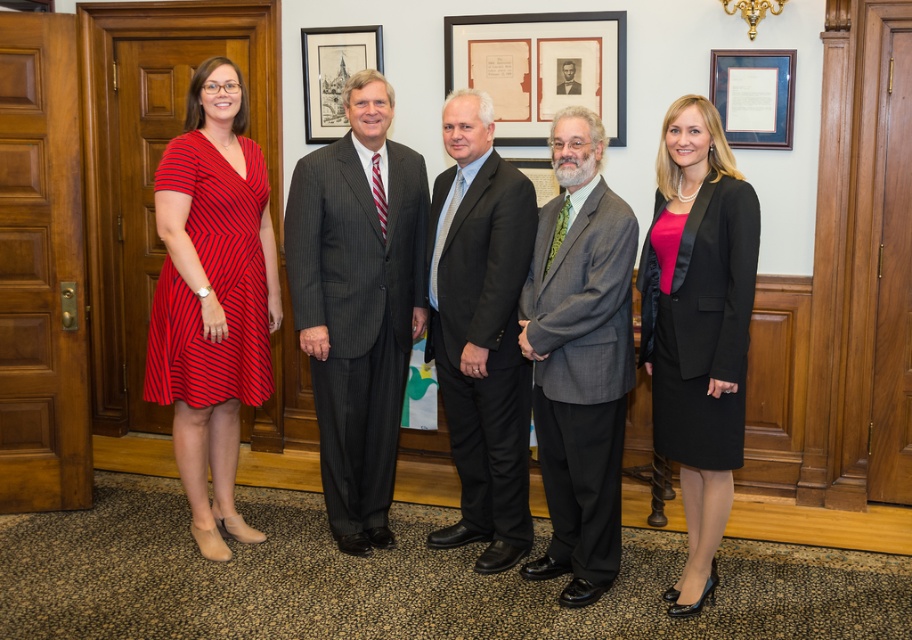
Looking at this image, looking at the group of five people in the formal setting, which of the two individuals wearing the gray wool suit at center and the black formal suit at center is positioned to the left?

The gray wool suit at center is positioned to the left of the black formal suit at center.

You are organizing a photo shoot and need to arrange the dark gray suit at center and the black formal suit at center in a specific order. According to the scene description, which one is on the left side?

The dark gray suit at center is positioned on the left side of the black formal suit at center.

You are a photographer setting up a camera to take a group photo of the five people. The camera is placed such that it can capture all individuals in the frame. You need to adjust the camera angle so that the dark gray suit at center and the black formal suit at center are aligned horizontally. Is this possible given their current positions?

The dark gray suit at center and the black formal suit at center are 1.44 meters apart. Since they are positioned at the center, adjusting the camera angle to align them horizontally is feasible as they are already centered and within a reasonable distance apart.